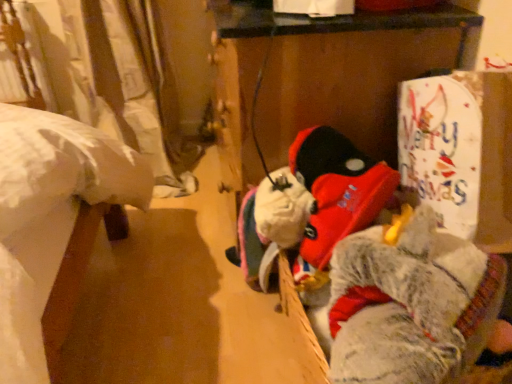
Question: Is white paper sign at upper right surrounded by fuzzy gray stuffed animal at right?

Choices:
 (A) no
 (B) yes

Answer: (A)

Question: Is fuzzy gray stuffed animal at right facing away from white paper sign at upper right?

Choices:
 (A) no
 (B) yes

Answer: (A)

Question: Considering the relative positions of fuzzy gray stuffed animal at right and white paper sign at upper right in the image provided, is fuzzy gray stuffed animal at right to the right of white paper sign at upper right from the viewer's perspective?

Choices:
 (A) no
 (B) yes

Answer: (A)

Question: From a real-world perspective, is fuzzy gray stuffed animal at right on top of white paper sign at upper right?

Choices:
 (A) no
 (B) yes

Answer: (A)

Question: From the image's perspective, is fuzzy gray stuffed animal at right on white paper sign at upper right?

Choices:
 (A) no
 (B) yes

Answer: (A)

Question: Considering the relative sizes of fuzzy gray stuffed animal at right and white paper sign at upper right in the image provided, is fuzzy gray stuffed animal at right bigger than white paper sign at upper right?

Choices:
 (A) no
 (B) yes

Answer: (B)

Question: Is white paper sign at upper right oriented towards fuzzy gray stuffed animal at right?

Choices:
 (A) yes
 (B) no

Answer: (B)

Question: Does white paper sign at upper right have a greater height compared to fuzzy gray stuffed animal at right?

Choices:
 (A) yes
 (B) no

Answer: (B)

Question: Considering the relative sizes of white paper sign at upper right and fuzzy gray stuffed animal at right in the image provided, is white paper sign at upper right shorter than fuzzy gray stuffed animal at right?

Choices:
 (A) no
 (B) yes

Answer: (B)

Question: Can you confirm if white paper sign at upper right is positioned to the left of fuzzy gray stuffed animal at right?

Choices:
 (A) no
 (B) yes

Answer: (A)

Question: Can you confirm if white paper sign at upper right is bigger than fuzzy gray stuffed animal at right?

Choices:
 (A) no
 (B) yes

Answer: (A)

Question: Are white paper sign at upper right and fuzzy gray stuffed animal at right making contact?

Choices:
 (A) yes
 (B) no

Answer: (B)

Question: Is white paper sign at upper right wider or thinner than fuzzy gray stuffed animal at right?

Choices:
 (A) thin
 (B) wide

Answer: (A)